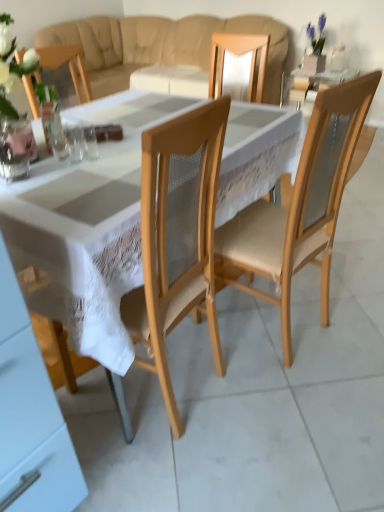
Where is `free space to the back side of clear glass at center, marked as the 2th tableware in a left-to-right arrangement`? This screenshot has height=512, width=384. free space to the back side of clear glass at center, marked as the 2th tableware in a left-to-right arrangement is located at coordinates (81, 141).